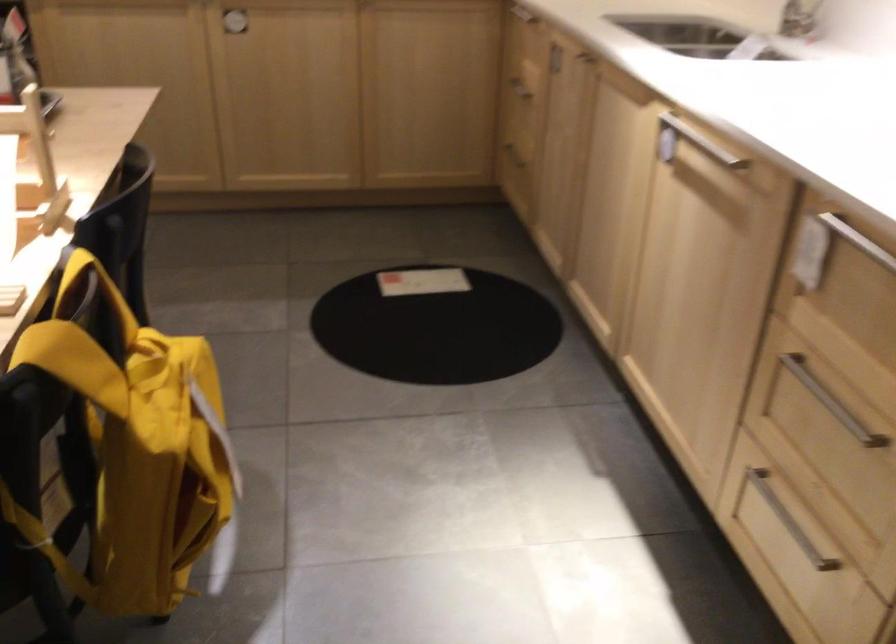
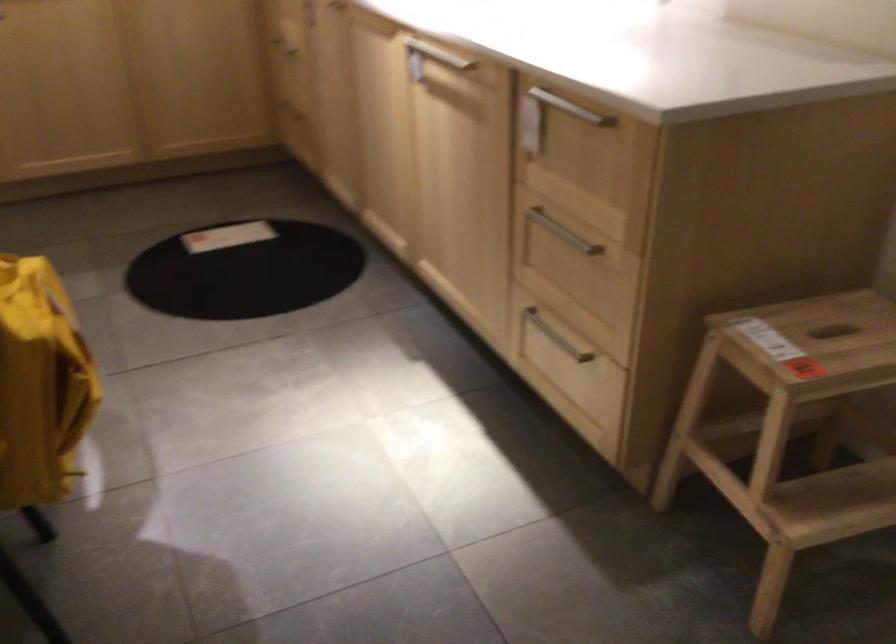
Find the pixel in the second image that matches point 823,393 in the first image.

(563, 232)